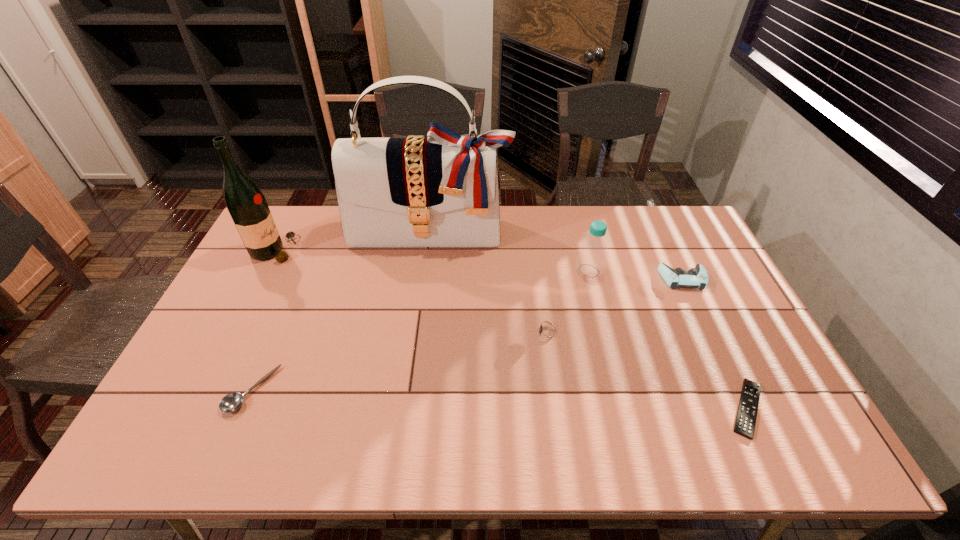
You are a GUI agent. You are given a task and a screenshot of the screen. Output one action in this format:
    pyautogui.click(x=<x>, y=<y>)
    Task: Click on the vacant space located 0.390m on the front-facing side of the tallest object
    This screenshot has height=540, width=960.
    Given the screenshot: What is the action you would take?
    pyautogui.click(x=416, y=343)

This screenshot has height=540, width=960. Find the location of `vacant position located 0.170m on the surface of the sixth shortest object`. vacant position located 0.170m on the surface of the sixth shortest object is located at coordinates (348, 250).

The image size is (960, 540). In order to click on blank space located 0.290m on the left of the bottle in this screenshot , I will do `click(487, 271)`.

Where is `free space located on the front of the control`? This screenshot has width=960, height=540. free space located on the front of the control is located at coordinates (733, 386).

Locate an element on the screen. This screenshot has width=960, height=540. free space located 0.160m on the face of the fourth object from left to right is located at coordinates (472, 333).

You are a GUI agent. You are given a task and a screenshot of the screen. Output one action in this format:
    pyautogui.click(x=<x>, y=<y>)
    Task: Click on the vacant space located 0.290m on the face of the fourth object from left to right
    
    Given the screenshot: What is the action you would take?
    pyautogui.click(x=427, y=333)

Where is `vacant position located 0.220m on the face of the fourth object from left to right`? The width and height of the screenshot is (960, 540). vacant position located 0.220m on the face of the fourth object from left to right is located at coordinates tap(451, 333).

Locate an element on the screen. vacant area situated on the left of the second shortest object is located at coordinates (190, 390).

Identify the location of free space located 0.330m on the left of the remote control. This screenshot has height=540, width=960. (588, 408).

Find the location of a particular element. satchel present at the far edge is located at coordinates (442, 191).